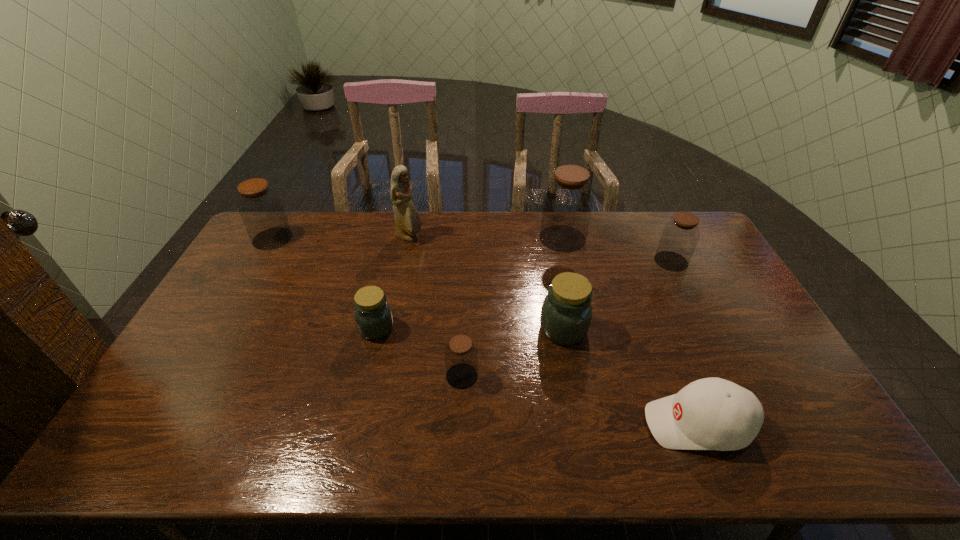
This screenshot has width=960, height=540. Identify the location of vacant point located 0.350m on the right of the second jar from left to right. (512, 328).

You are a GUI agent. You are given a task and a screenshot of the screen. Output one action in this format:
    pyautogui.click(x=<x>, y=<y>)
    Task: Click on the free location located 0.210m on the front-facing side of the nearest object
    
    Given the screenshot: What is the action you would take?
    pyautogui.click(x=560, y=424)

The height and width of the screenshot is (540, 960). Identify the location of vacant space situated 0.350m on the front-facing side of the nearest object. (502, 424).

The width and height of the screenshot is (960, 540). What are the coordinates of `vacant space situated on the front-facing side of the nearest object` in the screenshot? It's located at (609, 424).

Image resolution: width=960 pixels, height=540 pixels. I want to click on figurine situated at the far edge, so click(408, 222).

In order to click on object present at the near edge in this screenshot , I will do `click(712, 413)`.

Locate an element on the screen. The image size is (960, 540). object located in the left edge section of the desktop is located at coordinates (261, 209).

Identify the location of object situated at the right edge. The image size is (960, 540). (679, 238).

Where is `object that is at the far left corner`? This screenshot has width=960, height=540. object that is at the far left corner is located at coordinates (261, 209).

Locate an element on the screen. free space at the far edge of the desktop is located at coordinates 520,247.